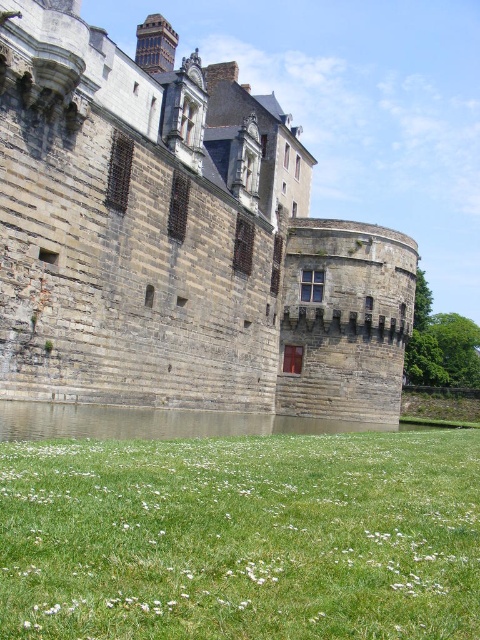
Who is positioned more to the right, gray stone castle at center or green grass at lower center?

Positioned to the right is green grass at lower center.

Describe the element at coordinates (178, 241) in the screenshot. I see `gray stone castle at center` at that location.

What do you see at coordinates (178, 241) in the screenshot? The width and height of the screenshot is (480, 640). I see `gray stone castle at center` at bounding box center [178, 241].

The image size is (480, 640). Find the location of `gray stone castle at center`. gray stone castle at center is located at coordinates (178, 241).